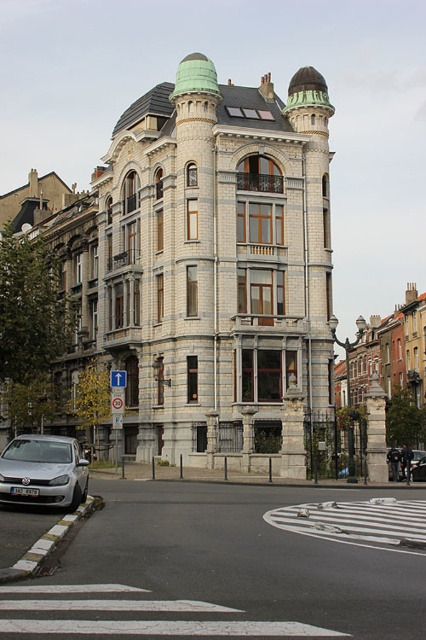
You are driving a car and want to park in the parking lot near the ornate building. There are two metallic silver cars already parked in the scene. The silver metallic car at lower left and the metallic silver car at center. How far apart are these two cars from each other?

The silver metallic car at lower left is 30.16 meters away from the metallic silver car at center.

You are a delivery driver and need to park your metallic silver car at center in a parking spot that is exactly the width of the white asphalt at center. Will your car fit in the parking spot?

The white asphalt at center is wider than the metallic silver car at center, so the car will fit in the parking spot.